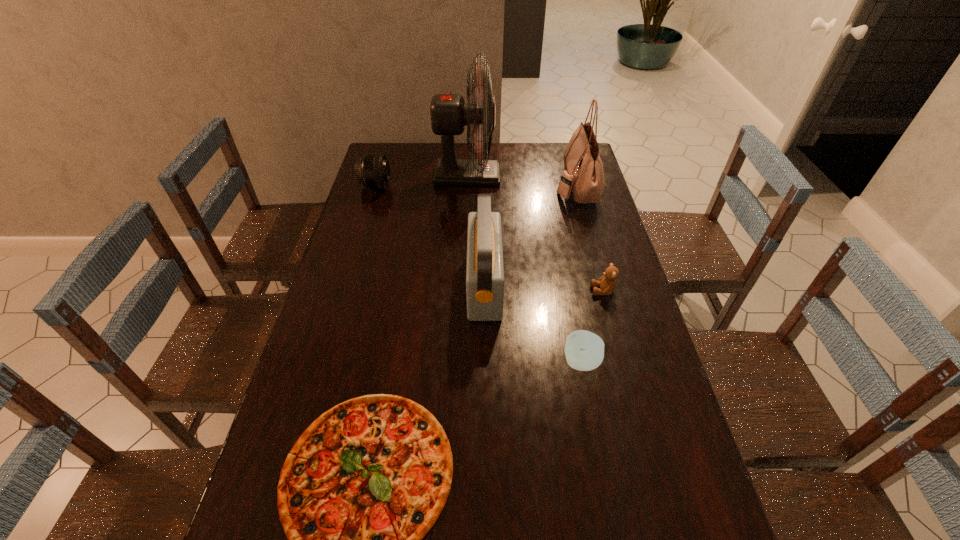
What are the coordinates of `object that is positioned at the left edge` in the screenshot? It's located at (372, 170).

At what (x,y) coordinates should I click in order to perform the action: click on handbag present at the right edge. Please return your answer as a coordinate pair (x, y). The image size is (960, 540). Looking at the image, I should click on (583, 176).

Locate an element on the screen. The width and height of the screenshot is (960, 540). apple that is positioned at the right edge is located at coordinates (584, 350).

This screenshot has width=960, height=540. In order to click on teddy bear that is at the right edge in this screenshot , I will do `click(607, 283)`.

Image resolution: width=960 pixels, height=540 pixels. In order to click on object that is at the far right corner in this screenshot , I will do `click(583, 176)`.

You are a GUI agent. You are given a task and a screenshot of the screen. Output one action in this format:
    pyautogui.click(x=<x>, y=<y>)
    Task: Click on the vacant point at the far edge
    Image resolution: width=960 pixels, height=540 pixels.
    Given the screenshot: What is the action you would take?
    pyautogui.click(x=524, y=168)

Locate an element on the screen. This screenshot has height=540, width=960. vacant space at the left edge of the desktop is located at coordinates (351, 288).

The height and width of the screenshot is (540, 960). Find the location of `vacant area at the right edge`. vacant area at the right edge is located at coordinates (659, 482).

In order to click on free space between the second tallest object and the tallest object in this screenshot , I will do `click(521, 181)`.

This screenshot has width=960, height=540. I want to click on vacant space that is in between the fifth shortest object and the teddy bear, so click(x=543, y=287).